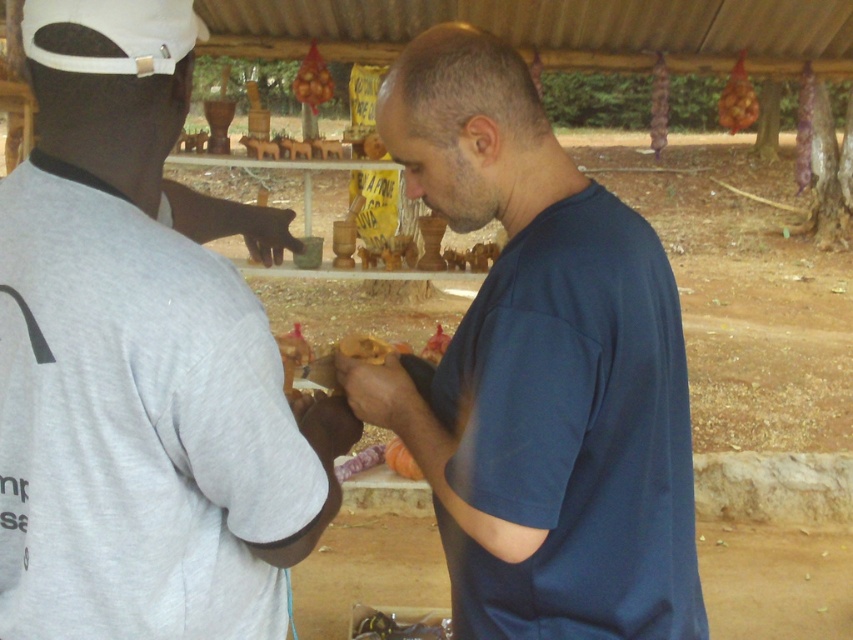
You are a customer at the market and want to know which seller has a thinner shirt between the gray matte shirt at left and the blue cotton shirt at center. Can you tell me which one?

The gray matte shirt at left is thinner than the blue cotton shirt at center.

You are a customer at the market stall. You see the blue cotton shirt at center and the smooth orange fruit at center. Which item is closer to you?

The blue cotton shirt at center is closer to you because it is in front of the smooth orange fruit at center.